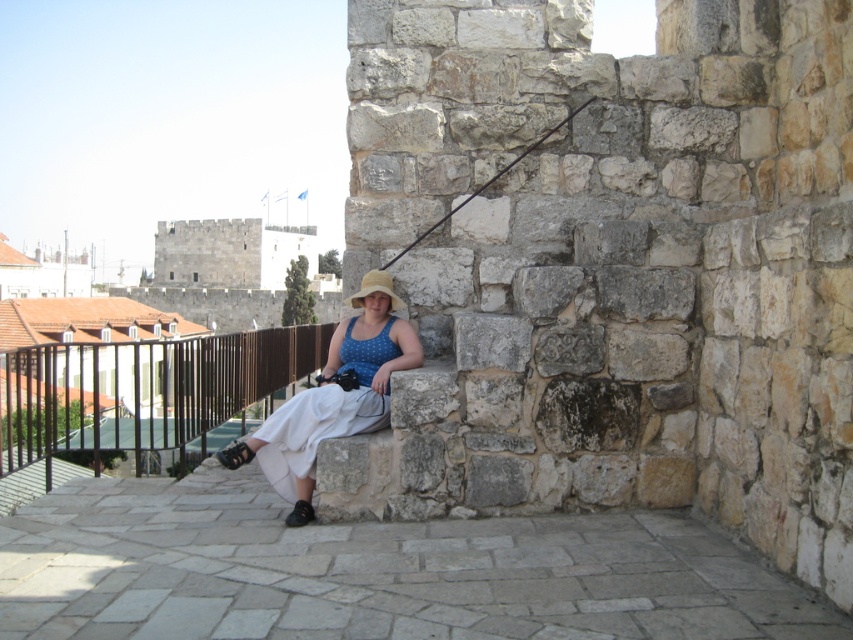
Which is below, matte blue dress at center or straw hat at center?

matte blue dress at center is lower down.

Is matte blue dress at center below straw hat at center?

Correct, matte blue dress at center is located below straw hat at center.

Between point (300, 426) and point (376, 285), which one is positioned behind?

The point (376, 285) is behind.

The width and height of the screenshot is (853, 640). In order to click on matte blue dress at center in this screenshot , I will do `click(331, 403)`.

Which is behind, point (318, 401) or point (445, 212)?

Point (445, 212)

Between matte blue dress at center and rusty metal fishing pole at upper center, which one appears on the right side from the viewer's perspective?

rusty metal fishing pole at upper center

Identify the location of matte blue dress at center. The width and height of the screenshot is (853, 640). (331, 403).

At what (x,y) coordinates should I click in order to perform the action: click on matte blue dress at center. Please return your answer as a coordinate pair (x, y). Looking at the image, I should click on click(331, 403).

Does rusty metal fishing pole at upper center have a greater width compared to straw hat at center?

Indeed, rusty metal fishing pole at upper center has a greater width compared to straw hat at center.

Who is more forward, (473,193) or (386,284)?

Positioned in front is point (386,284).

At what (x,y) coordinates should I click in order to perform the action: click on rusty metal fishing pole at upper center. Please return your answer as a coordinate pair (x, y). The height and width of the screenshot is (640, 853). Looking at the image, I should click on (489, 180).